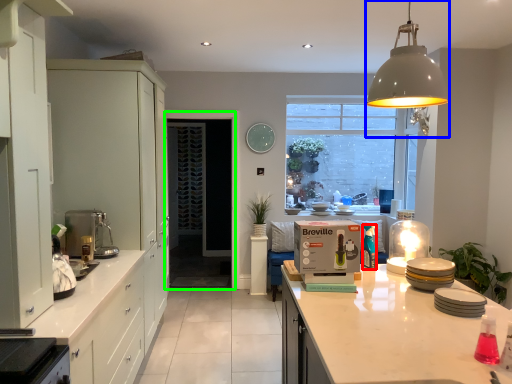
Question: Estimate the real-world distances between objects in this image. Which object is closer to bottle (highlighted by a red box), light fixture (highlighted by a blue box) or screen door (highlighted by a green box)?

Choices:
 (A) light fixture
 (B) screen door

Answer: (A)